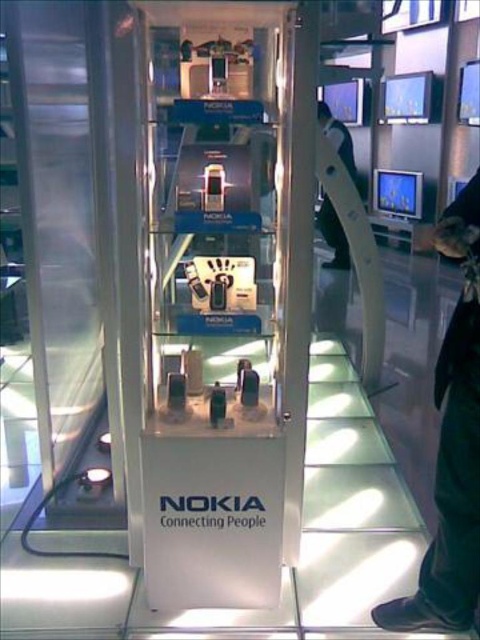
You are standing in front of the Nokia product display and notice an object at the lower right corner of the image. What is the exact location of the black fabric pants at lower right in the coordinate system provided?

The black fabric pants at lower right is located at point coordinates (x=451, y=490).

You are a security guard at the Nokia exhibition. You notice two items displayed in the glass case. The black fabric pants at lower right and the black leather jacket at upper center. Which item is taller?

The black fabric pants at lower right is much taller than the black leather jacket at upper center.

In the scene shown: You are at the Nokia product display and want to reach the point labeled point (423,556) from point (342,248). Can you walk directly to it without moving around any obstacles?

Point (423,556) is in front of point (342,248), so you can walk directly to it without moving around any obstacles.